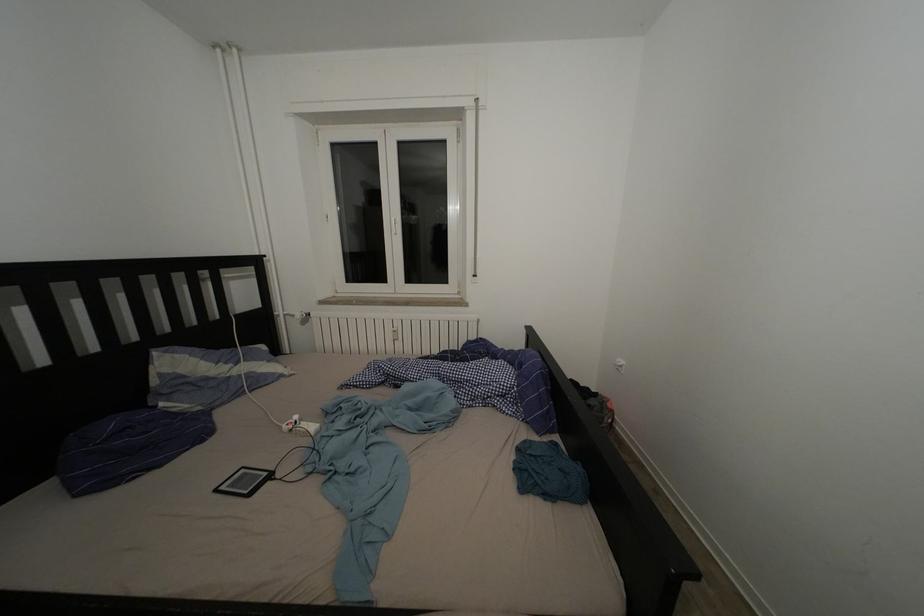
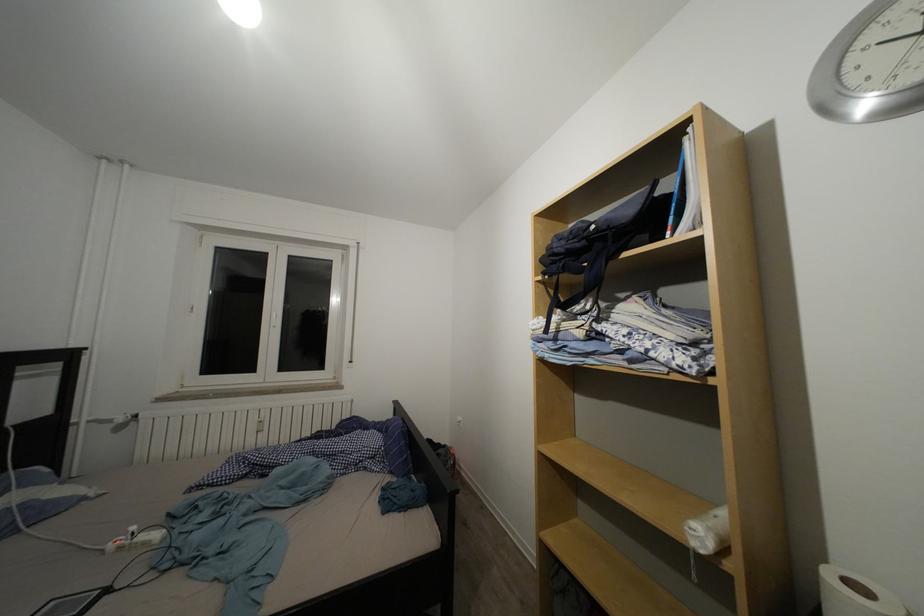
Where in the second image is the point corresponding to point 304,424 from the first image?

(140, 533)